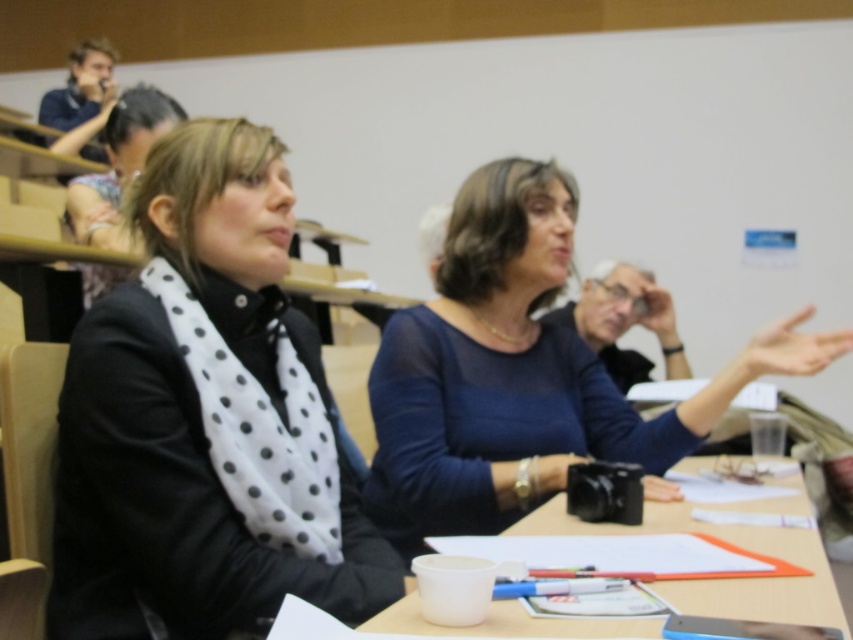
Does blue sheer blouse at center have a greater height compared to white plastic cup at lower center?

Yes, blue sheer blouse at center is taller than white plastic cup at lower center.

Does blue sheer blouse at center have a lesser height compared to white plastic cup at lower center?

In fact, blue sheer blouse at center may be taller than white plastic cup at lower center.

At what (x,y) coordinates should I click in order to perform the action: click on blue sheer blouse at center. Please return your answer as a coordinate pair (x, y). The width and height of the screenshot is (853, 640). Looking at the image, I should click on (520, 372).

Locate an element on the screen. blue sheer blouse at center is located at coordinates (520, 372).

Is point (265, 545) less distant than point (433, 504)?

Yes, point (265, 545) is in front of point (433, 504).

The width and height of the screenshot is (853, 640). Identify the location of white dotted scarf at center. (206, 419).

Can you confirm if white dotted scarf at center is bigger than white plastic cup at lower center?

Correct, white dotted scarf at center is larger in size than white plastic cup at lower center.

Which is more to the right, white dotted scarf at center or white plastic cup at lower center?

white plastic cup at lower center is more to the right.

Does point (274, 608) come behind point (558, 509)?

No, (274, 608) is closer to viewer.

Locate an element on the screen. The height and width of the screenshot is (640, 853). white dotted scarf at center is located at coordinates (206, 419).